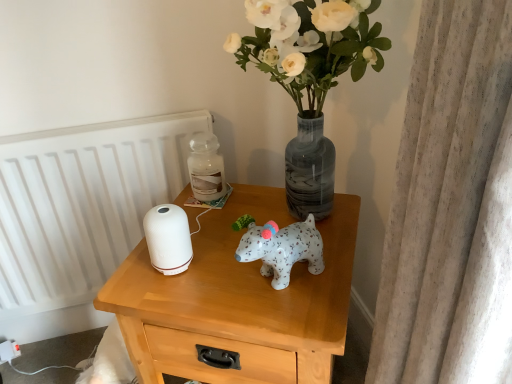
The image size is (512, 384). Find the location of `vacant space positioned to the left of white matte vase at upper center`. vacant space positioned to the left of white matte vase at upper center is located at coordinates (196, 241).